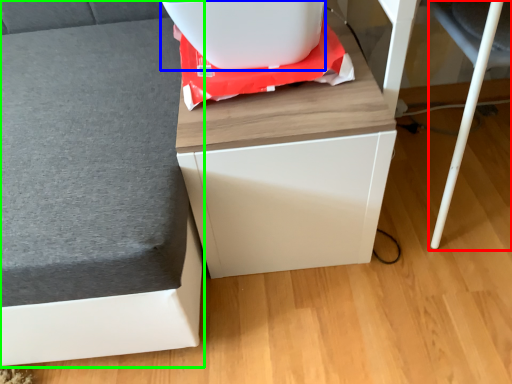
Question: Which object is the closest to the swivel chair (highlighted by a red box)? Choose among these: appliance (highlighted by a blue box) or furniture (highlighted by a green box).

Choices:
 (A) appliance
 (B) furniture

Answer: (A)